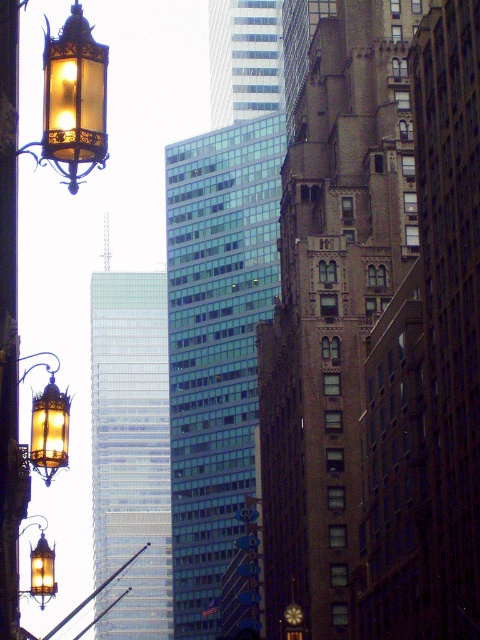
Question: Is matte glass lantern at upper left to the right of matte glass lantern at left from the viewer's perspective?

Choices:
 (A) no
 (B) yes

Answer: (A)

Question: Does matte glass lantern at upper left appear on the left side of matte glass lantern at left?

Choices:
 (A) yes
 (B) no

Answer: (A)

Question: Which object appears closest to the camera in this image?

Choices:
 (A) matte glass lantern at upper left
 (B) matte brass lantern at left
 (C) matte brass lantern at upper left

Answer: (A)

Question: Is matte glass lantern at upper left further to the viewer compared to matte brass lantern at left?

Choices:
 (A) yes
 (B) no

Answer: (B)

Question: Among these objects, which one is farthest from the camera?

Choices:
 (A) matte glass lantern at left
 (B) matte brass lantern at upper left
 (C) matte brass lantern at left

Answer: (C)

Question: Which point is farther to the camera?

Choices:
 (A) (32, 524)
 (B) (39, 436)
 (C) (51, 161)

Answer: (A)